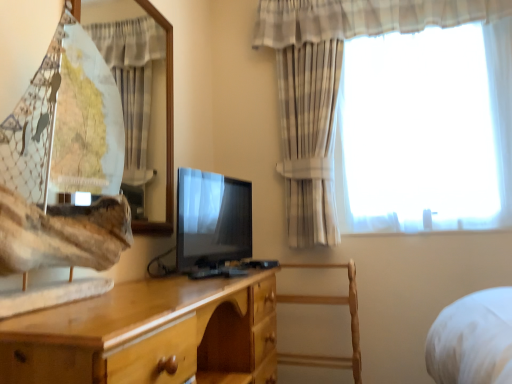
The image size is (512, 384). What are the coordinates of `vacant space underneath matte black tv at center (from a real-world perspective)` in the screenshot? It's located at pos(213,260).